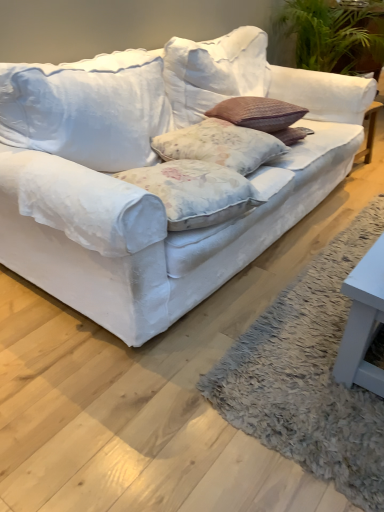
The image size is (384, 512). I want to click on white fabric couch at center, so click(184, 232).

Measure the distance between white fabric couch at center and camera.

white fabric couch at center and camera are 1.11 meters apart from each other.

Describe the element at coordinates (184, 232) in the screenshot. The image size is (384, 512). I see `white fabric couch at center` at that location.

What is the approximate height of white fabric couch at center?

The height of white fabric couch at center is 34.28 inches.

Locate an element on the screen. The image size is (384, 512). floral fabric pillow at center is located at coordinates (220, 145).

What do you see at coordinates (220, 145) in the screenshot? The width and height of the screenshot is (384, 512). I see `floral fabric pillow at center` at bounding box center [220, 145].

I want to click on white fabric couch at center, so click(184, 232).

Considering the relative positions of white fabric couch at center and floral fabric pillow at center in the image provided, is white fabric couch at center to the right of floral fabric pillow at center from the viewer's perspective?

In fact, white fabric couch at center is to the left of floral fabric pillow at center.

Is white fabric couch at center in front of floral fabric pillow at center?

That is True.

Which point is more distant from viewer, (233,251) or (231,139)?

The point (231,139) is farther from the camera.

From the image's perspective, does white fabric couch at center appear higher than floral fabric pillow at center?

Correct, white fabric couch at center appears higher than floral fabric pillow at center in the image.

From a real-world perspective, which is physically above, white fabric couch at center or floral fabric pillow at center?

From a 3D spatial view, floral fabric pillow at center is above.

Consider the image. Considering the sizes of objects white fabric couch at center and floral fabric pillow at center in the image provided, who is wider, white fabric couch at center or floral fabric pillow at center?

white fabric couch at center is wider.

Which of these two, white fabric couch at center or floral fabric pillow at center, stands shorter?

With less height is floral fabric pillow at center.

Consider the image. Based on their sizes in the image, would you say white fabric couch at center is bigger or smaller than floral fabric pillow at center?

In the image, white fabric couch at center appears to be larger than floral fabric pillow at center.

Is white fabric couch at center not within floral fabric pillow at center?

That's correct, white fabric couch at center is outside of floral fabric pillow at center.

Are white fabric couch at center and floral fabric pillow at center located far from each other?

white fabric couch at center is near floral fabric pillow at center, not far away.

Is white fabric couch at center turned away from floral fabric pillow at center?

Correct, white fabric couch at center is looking away from floral fabric pillow at center.

Measure the distance from white fabric couch at center to floral fabric pillow at center.

white fabric couch at center and floral fabric pillow at center are 34.26 centimeters apart from each other.

This screenshot has height=512, width=384. Identify the location of pillow above the white fabric couch at center (from a real-world perspective). (220, 145).

Would you say floral fabric pillow at center is to the left or to the right of white fabric couch at center in the picture?

floral fabric pillow at center is positioned on white fabric couch at center's right side.

Which object is closer to the camera taking this photo, floral fabric pillow at center or white fabric couch at center?

Positioned in front is white fabric couch at center.

Looking at this image, which is less distant, (x=234, y=130) or (x=329, y=74)?

Point (x=234, y=130).

From the image's perspective, which object appears higher, floral fabric pillow at center or white fabric couch at center?

white fabric couch at center appears higher in the image.

From a real-world perspective, does floral fabric pillow at center stand above white fabric couch at center?

Yes.

Does floral fabric pillow at center have a lesser width compared to white fabric couch at center?

Yes.

Who is shorter, floral fabric pillow at center or white fabric couch at center?

With less height is floral fabric pillow at center.

Can you confirm if floral fabric pillow at center is bigger than white fabric couch at center?

No, floral fabric pillow at center is not bigger than white fabric couch at center.

Can we say floral fabric pillow at center lies outside white fabric couch at center?

No, floral fabric pillow at center is not entirely external to white fabric couch at center.

Are floral fabric pillow at center and white fabric couch at center located far from each other?

floral fabric pillow at center is actually quite close to white fabric couch at center.

Is floral fabric pillow at center aimed at white fabric couch at center?

Yes, floral fabric pillow at center is aimed at white fabric couch at center.

How many degrees apart are the facing directions of floral fabric pillow at center and white fabric couch at center?

The angular difference between floral fabric pillow at center and white fabric couch at center is 3.37 degrees.

Consider the image. Measure the distance from floral fabric pillow at center to white fabric couch at center.

A distance of 13.49 inches exists between floral fabric pillow at center and white fabric couch at center.

This screenshot has height=512, width=384. Find the location of `studio couch below the floral fabric pillow at center (from a real-world perspective)`. studio couch below the floral fabric pillow at center (from a real-world perspective) is located at coordinates (184, 232).

Image resolution: width=384 pixels, height=512 pixels. I want to click on studio couch below the floral fabric pillow at center (from a real-world perspective), so click(184, 232).

At what (x,y) coordinates should I click in order to perform the action: click on pillow below the white fabric couch at center (from the image's perspective). Please return your answer as a coordinate pair (x, y). Image resolution: width=384 pixels, height=512 pixels. Looking at the image, I should click on (220, 145).